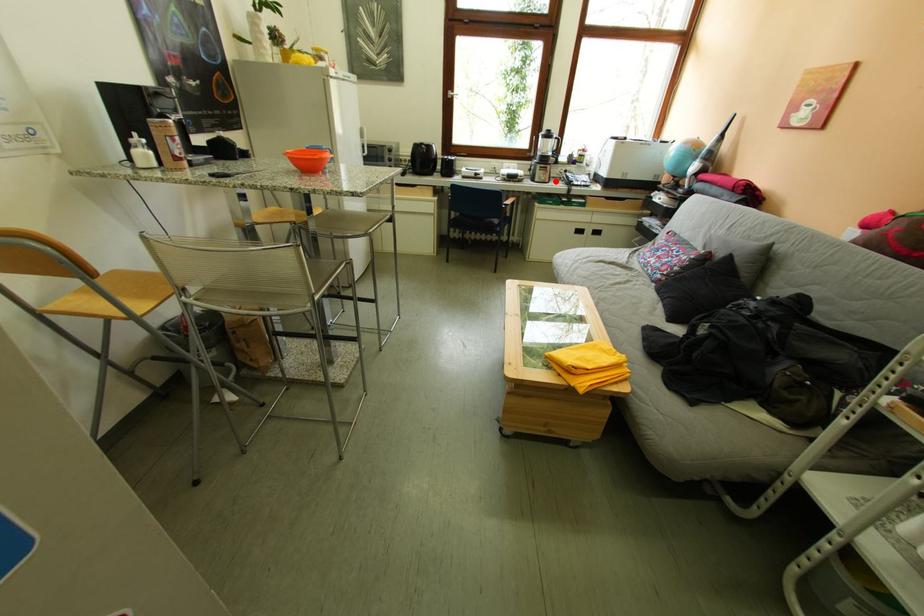
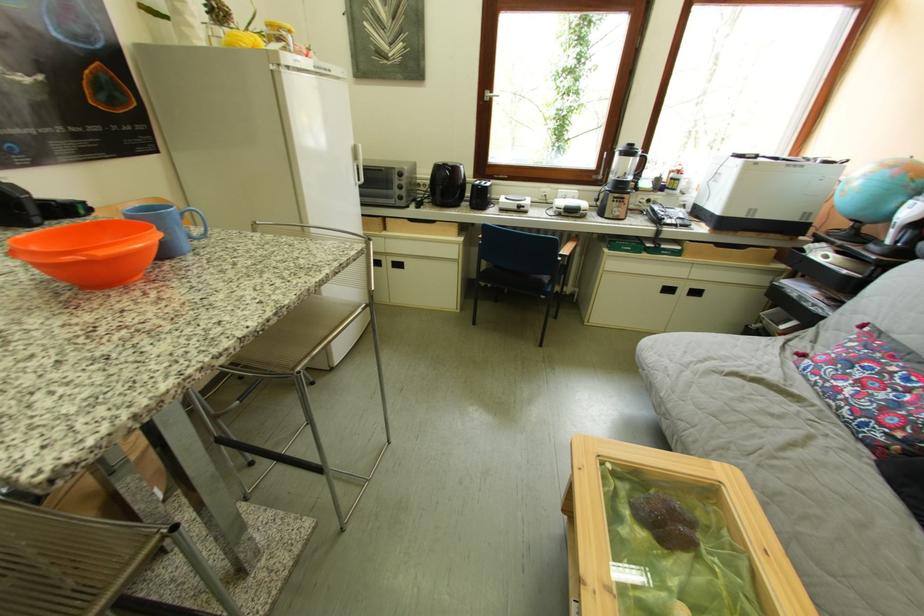
Where in the second image is the point corresponding to the highlighted location from the first image?

(629, 217)